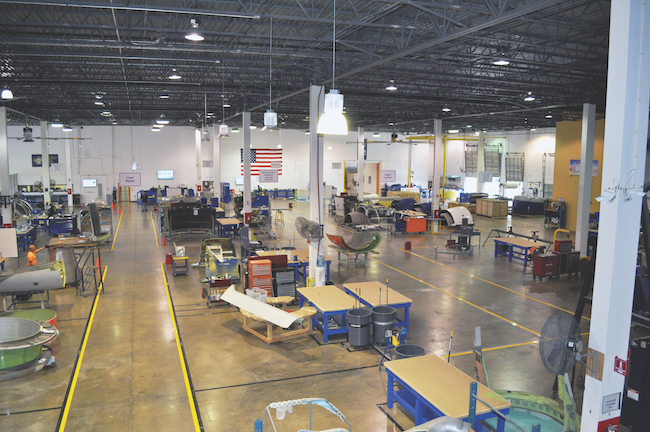
At what (x,y) coordinates should I click in order to perform the action: click on fan. Please return your answer as a coordinate pair (x, y). Looking at the image, I should click on (556, 340).